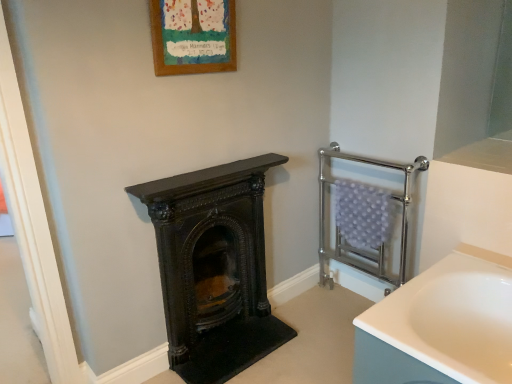
Question: Is chrome metallic towel rack at right wider or thinner than wooden frame at upper center?

Choices:
 (A) wide
 (B) thin

Answer: (A)

Question: From the image's perspective, is chrome metallic towel rack at right above or below wooden frame at upper center?

Choices:
 (A) above
 (B) below

Answer: (B)

Question: Estimate the real-world distances between objects in this image. Which object is closer to the wooden frame at upper center?

Choices:
 (A) chrome metallic towel rack at right
 (B) black polished wood burning stove at center

Answer: (B)

Question: Estimate the real-world distances between objects in this image. Which object is closer to the wooden frame at upper center?

Choices:
 (A) black polished wood burning stove at center
 (B) chrome metallic towel rack at right

Answer: (A)